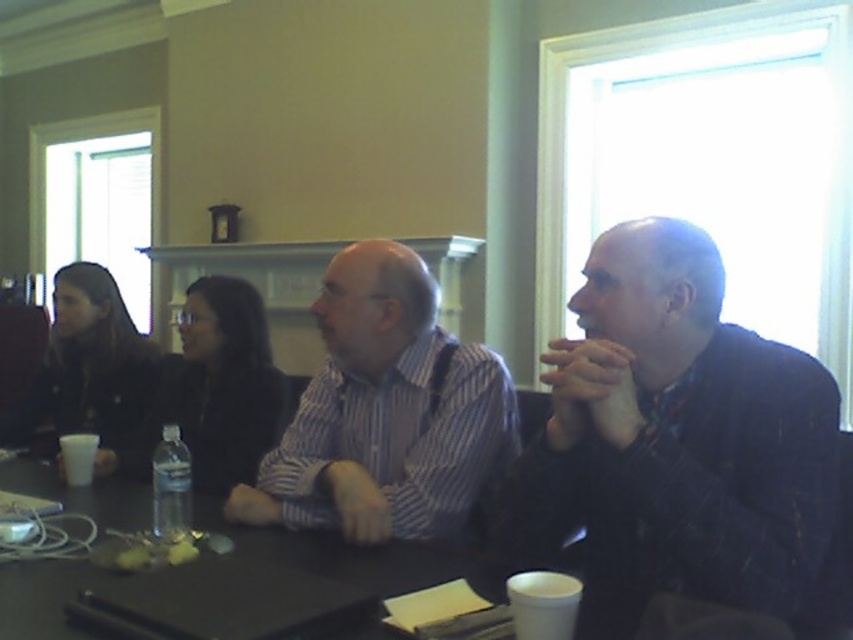
Is the position of dark textured jacket at right less distant than that of striped cotton shirt at center?

Yes, it is.

Does dark textured jacket at right have a larger size compared to striped cotton shirt at center?

No, dark textured jacket at right is not bigger than striped cotton shirt at center.

Identify the location of dark textured jacket at right. 675,442.

Does dark textured jacket at right have a lesser height compared to clear plastic bottle at table center?

Incorrect, dark textured jacket at right's height does not fall short of clear plastic bottle at table center's.

Does dark textured jacket at right appear on the right side of clear plastic bottle at table center?

Correct, you'll find dark textured jacket at right to the right of clear plastic bottle at table center.

Does point (749, 420) lie behind point (164, 512)?

No, (749, 420) is in front of (164, 512).

At what (x,y) coordinates should I click in order to perform the action: click on dark textured jacket at right. Please return your answer as a coordinate pair (x, y). Image resolution: width=853 pixels, height=640 pixels. Looking at the image, I should click on (675, 442).

Which is more to the left, striped cotton shirt at center or clear plastic bottle at table center?

Positioned to the left is clear plastic bottle at table center.

The height and width of the screenshot is (640, 853). Identify the location of striped cotton shirt at center. (386, 413).

Does point (453, 472) come behind point (190, 524)?

That is True.

This screenshot has height=640, width=853. Identify the location of striped cotton shirt at center. (386, 413).